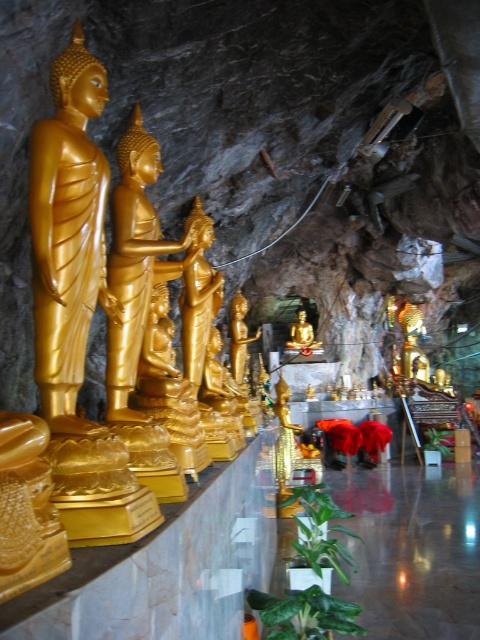
Can you confirm if gold polished statue at left is shorter than gold polished statue at center?

No.

Is gold polished statue at left to the right of gold polished statue at center from the viewer's perspective?

In fact, gold polished statue at left is to the left of gold polished statue at center.

The image size is (480, 640). Describe the element at coordinates (68, 234) in the screenshot. I see `gold polished statue at left` at that location.

Identify the location of gold polished statue at left. The image size is (480, 640). (68, 234).